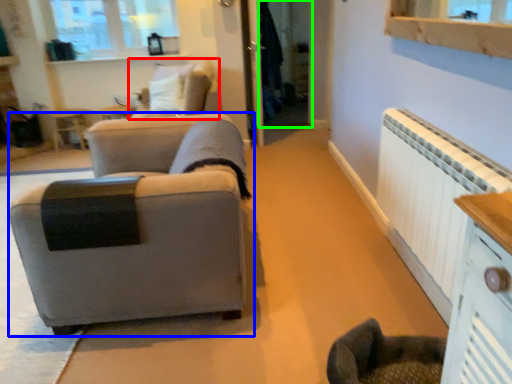
Question: Considering the real-world distances, which object is closest to swivel chair (highlighted by a red box)? studio couch (highlighted by a blue box) or glass door (highlighted by a green box).

Choices:
 (A) studio couch
 (B) glass door

Answer: (B)